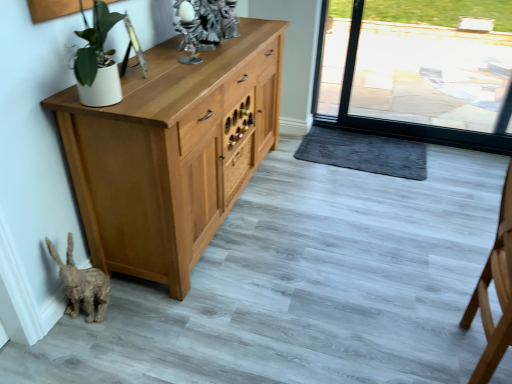
Question: From the image's perspective, is light brown wooden chair at right located beneath wooden drawer at center?

Choices:
 (A) no
 (B) yes

Answer: (B)

Question: From the image's perspective, is light brown wooden chair at right on top of wooden drawer at center?

Choices:
 (A) yes
 (B) no

Answer: (B)

Question: Would you say wooden drawer at center is part of light brown wooden chair at right's contents?

Choices:
 (A) yes
 (B) no

Answer: (B)

Question: Does light brown wooden chair at right have a larger size compared to wooden drawer at center?

Choices:
 (A) no
 (B) yes

Answer: (B)

Question: Does light brown wooden chair at right have a greater width compared to wooden drawer at center?

Choices:
 (A) yes
 (B) no

Answer: (A)

Question: Could you tell me if light brown wooden chair at right is turned towards wooden drawer at center?

Choices:
 (A) no
 (B) yes

Answer: (A)

Question: Is dark gray plush doormat at lower center oriented towards light brown wooden chair at right?

Choices:
 (A) no
 (B) yes

Answer: (A)

Question: Is dark gray plush doormat at lower center outside light brown wooden chair at right?

Choices:
 (A) no
 (B) yes

Answer: (B)

Question: From a real-world perspective, is dark gray plush doormat at lower center beneath light brown wooden chair at right?

Choices:
 (A) no
 (B) yes

Answer: (B)

Question: Considering the relative sizes of dark gray plush doormat at lower center and light brown wooden chair at right in the image provided, is dark gray plush doormat at lower center taller than light brown wooden chair at right?

Choices:
 (A) yes
 (B) no

Answer: (B)

Question: From the image's perspective, does dark gray plush doormat at lower center appear lower than light brown wooden chair at right?

Choices:
 (A) yes
 (B) no

Answer: (B)

Question: Can you confirm if dark gray plush doormat at lower center is bigger than light brown wooden chair at right?

Choices:
 (A) yes
 (B) no

Answer: (B)

Question: From the image's perspective, is dark gray plush doormat at lower center above wooden drawer at center?

Choices:
 (A) yes
 (B) no

Answer: (A)